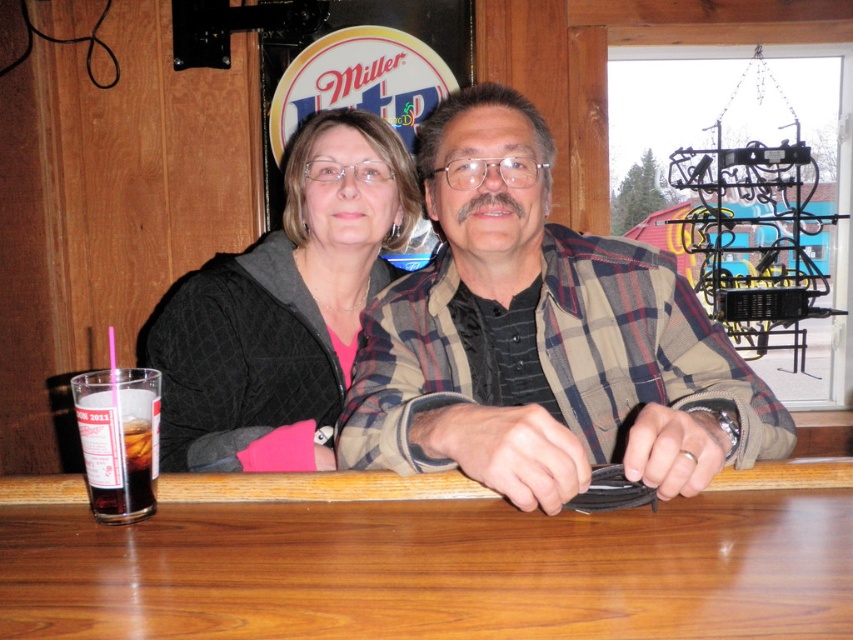
Question: Does brown wood table at center have a greater width compared to black quilted jacket at upper left?

Choices:
 (A) yes
 (B) no

Answer: (A)

Question: Which point appears closest to the camera in this image?

Choices:
 (A) (485, 401)
 (B) (276, 381)
 (C) (340, 513)

Answer: (C)

Question: Which of the following is the farthest from the observer?

Choices:
 (A) plaid flannel shirt at center
 (B) brown wood table at center
 (C) black quilted jacket at upper left

Answer: (C)

Question: Can you confirm if plaid flannel shirt at center is positioned above black quilted jacket at upper left?

Choices:
 (A) no
 (B) yes

Answer: (A)

Question: Estimate the real-world distances between objects in this image. Which object is closer to the black quilted jacket at upper left?

Choices:
 (A) plaid flannel shirt at center
 (B) brown wood table at center

Answer: (A)

Question: Considering the relative positions of brown wood table at center and black quilted jacket at upper left in the image provided, where is brown wood table at center located with respect to black quilted jacket at upper left?

Choices:
 (A) right
 (B) left

Answer: (A)